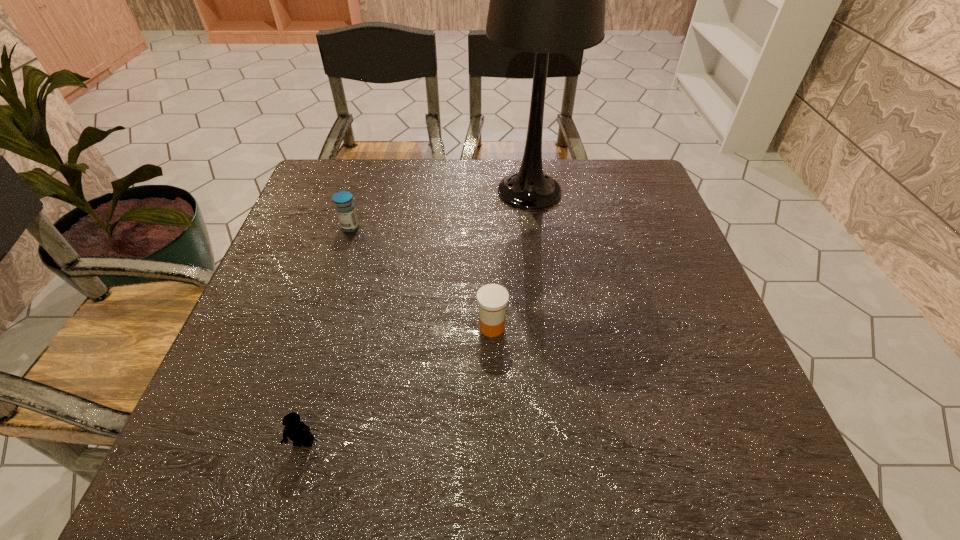
You are a GUI agent. You are given a task and a screenshot of the screen. Output one action in this format:
    pyautogui.click(x=<x>, y=<y>)
    Task: Click on the free region at the far left corner of the desktop
    
    Given the screenshot: What is the action you would take?
    pyautogui.click(x=343, y=167)

I want to click on vacant space at the near left corner of the desktop, so click(178, 472).

Where is `vacant space at the far right corner`? Image resolution: width=960 pixels, height=540 pixels. vacant space at the far right corner is located at coordinates (629, 187).

At what (x,y) coordinates should I click in order to perform the action: click on free space between the nearer medicine and the nearest object. Please return your answer as a coordinate pair (x, y). Looking at the image, I should click on (397, 385).

Locate an element on the screen. The height and width of the screenshot is (540, 960). free spot between the right medicine and the table lamp is located at coordinates (511, 259).

The image size is (960, 540). Find the location of `free spot between the nearest object and the farthest object`. free spot between the nearest object and the farthest object is located at coordinates (417, 317).

At what (x,y) coordinates should I click in order to perform the action: click on free spot between the farthest object and the third farthest object. Please return your answer as a coordinate pair (x, y). This screenshot has width=960, height=540. Looking at the image, I should click on (511, 259).

Locate an element on the screen. free space that is in between the farthest object and the Lego is located at coordinates (x=417, y=317).

In order to click on empty space that is in between the nearer medicine and the shortest object in this screenshot , I will do `click(397, 385)`.

What are the coordinates of `unoccupied position between the third nearest object and the right medicine` in the screenshot? It's located at (421, 277).